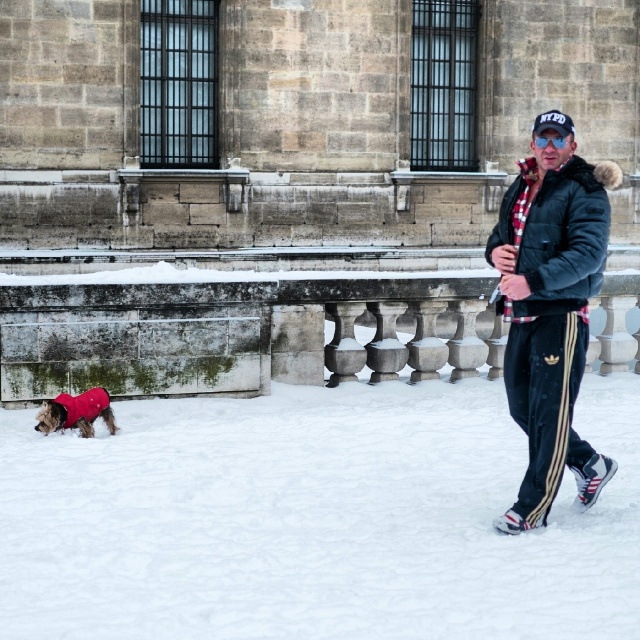
Question: Does black matte jacket at right appear on the left side of plaid woolen jacket at center?

Choices:
 (A) no
 (B) yes

Answer: (B)

Question: In this image, where is black matte jacket at right located relative to red fleece coat at lower left?

Choices:
 (A) right
 (B) left

Answer: (A)

Question: Does plaid woolen jacket at center have a smaller size compared to red fleece coat at lower left?

Choices:
 (A) no
 (B) yes

Answer: (A)

Question: Which object is the closest to the white fluffy snow at lower left?

Choices:
 (A) plaid woolen jacket at center
 (B) red fleece coat at lower left

Answer: (B)

Question: Based on their relative distances, which object is farther from the black matte jacket at right?

Choices:
 (A) red fleece coat at lower left
 (B) white fluffy snow at lower left
 (C) plaid woolen jacket at center

Answer: (C)

Question: Estimate the real-world distances between objects in this image. Which object is farther from the white fluffy snow at lower left?

Choices:
 (A) red fleece coat at lower left
 (B) plaid woolen jacket at center

Answer: (B)